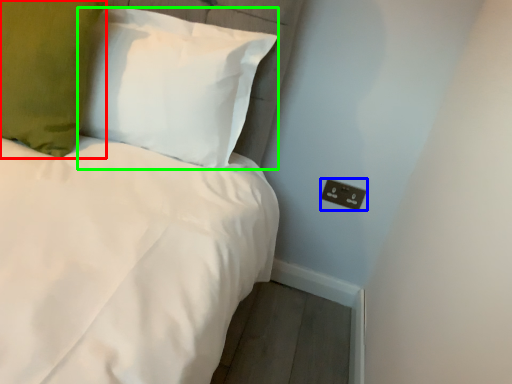
Question: Estimate the real-world distances between objects in this image. Which object is closer to pillow (highlighted by a red box), electric outlet (highlighted by a blue box) or pillow (highlighted by a green box)?

Choices:
 (A) electric outlet
 (B) pillow

Answer: (B)